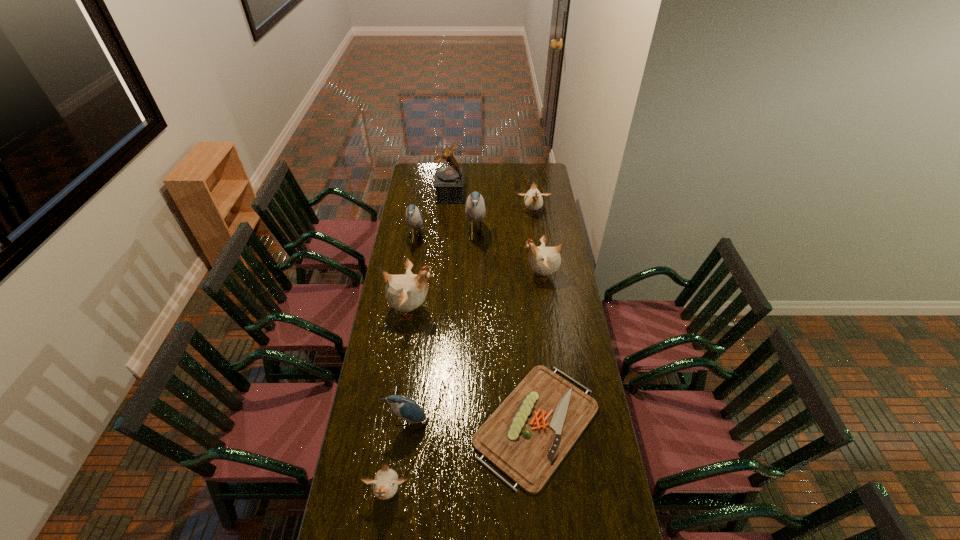
Locate an element on the screen. The image size is (960, 540). blue bird that stands as the closest to the third bird from right to left is located at coordinates (413, 217).

In order to click on white bird identified as the third closest to the farthest white bird in this screenshot , I will do `click(385, 484)`.

Identify which white bird is the closest to the smallest blue bird. Please provide its 2D coordinates. Your answer should be formatted as a tuple, i.e. [(x, y)], where the tuple contains the x and y coordinates of a point satisfying the conditions above.

[(385, 484)]

The height and width of the screenshot is (540, 960). Identify the location of free space that satisfies the following two spatial constraints: 1. at the beak of the third smallest white bird; 2. at the beak of the shortest bird. (572, 492).

Identify the location of vacant space that satisfies the following two spatial constraints: 1. at the tip of the biggest blue bird's beak; 2. at the tip of the smallest blue bird's beak. (473, 422).

At what (x,y) coordinates should I click in order to perform the action: click on free location that satisfies the following two spatial constraints: 1. at the tip of the chopping board's beak; 2. on the right side of the nearest blue bird. Please return your answer as a coordinate pair (x, y). The image size is (960, 540). Looking at the image, I should click on (405, 424).

Where is `vacant point that satisfies the following two spatial constraints: 1. at the tip of the smallest blue bird's beak; 2. on the left side of the shortest object`? Image resolution: width=960 pixels, height=540 pixels. vacant point that satisfies the following two spatial constraints: 1. at the tip of the smallest blue bird's beak; 2. on the left side of the shortest object is located at coordinates (405, 424).

At what (x,y) coordinates should I click in order to perform the action: click on free space in the image that satisfies the following two spatial constraints: 1. at the tip of the shortest object's beak; 2. on the right side of the second biggest blue bird. Please return your answer as a coordinate pair (x, y). Looking at the image, I should click on pyautogui.click(x=387, y=424).